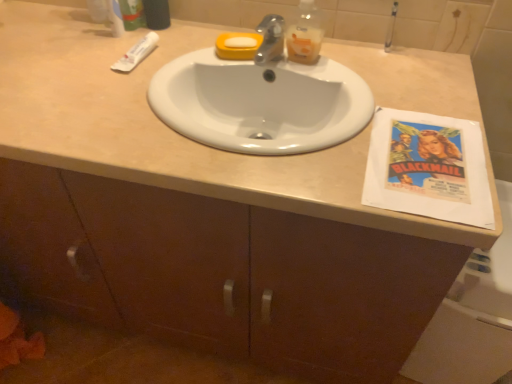
Question: Does point 145,54 appear closer or farther from the camera than point 287,34?

Choices:
 (A) farther
 (B) closer

Answer: (A)

Question: From the image's perspective, is white matte tube at upper left located above or below translucent plastic bottle at upper center?

Choices:
 (A) below
 (B) above

Answer: (A)

Question: Based on their relative distances, which object is farther from the white matte tube at upper left?

Choices:
 (A) white paper at right
 (B) translucent plastic bottle at upper center
 (C) white glossy sink at center
 (D) green matte toothpaste tube at upper left

Answer: (A)

Question: Which object is the farthest from the white paper at right?

Choices:
 (A) translucent plastic bottle at upper center
 (B) white glossy sink at center
 (C) white matte tube at upper left
 (D) green matte toothpaste tube at upper left

Answer: (D)